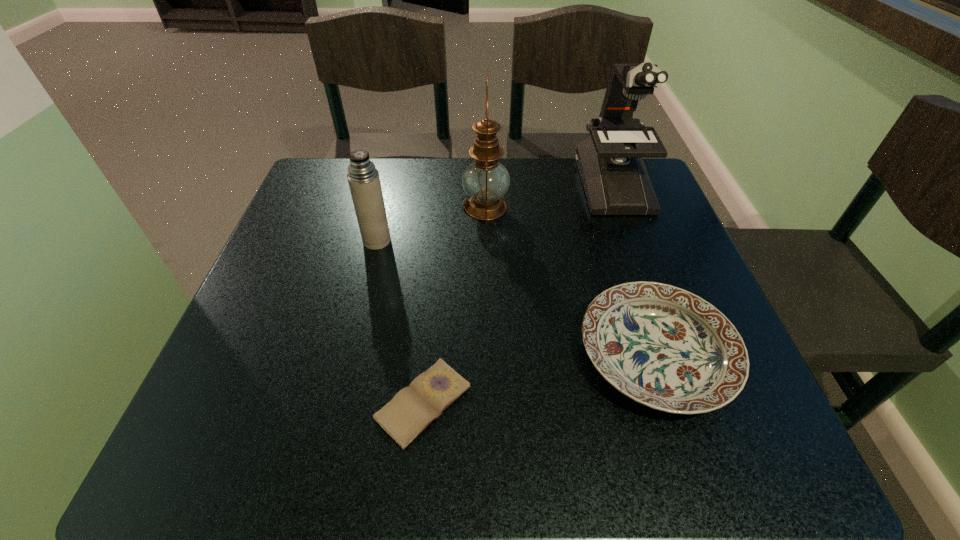
Find the location of a particular element. vacant area at the left edge is located at coordinates (300, 262).

In the image, there is a desktop. At what (x,y) coordinates should I click in order to perform the action: click on vacant space at the right edge. Please return your answer as a coordinate pair (x, y). The width and height of the screenshot is (960, 540). Looking at the image, I should click on (626, 279).

At what (x,y) coordinates should I click in order to perform the action: click on vacant area at the near left corner of the desktop. Please return your answer as a coordinate pair (x, y). Looking at the image, I should click on (239, 423).

In order to click on vacant area that lies between the shortest object and the microscope in this screenshot , I will do `click(518, 294)`.

At what (x,y) coordinates should I click in order to perform the action: click on unoccupied position between the oil lamp and the microscope. Please return your answer as a coordinate pair (x, y). The image size is (960, 540). Looking at the image, I should click on [549, 196].

You are a GUI agent. You are given a task and a screenshot of the screen. Output one action in this format:
    pyautogui.click(x=<x>, y=<y>)
    Task: Click on the free space between the plate and the oil lamp
    
    Given the screenshot: What is the action you would take?
    pyautogui.click(x=570, y=281)

Locate an element on the screen. This screenshot has height=540, width=960. empty location between the microscope and the second shortest object is located at coordinates (634, 270).

Where is `free spot between the plate and the oil lamp`? Image resolution: width=960 pixels, height=540 pixels. free spot between the plate and the oil lamp is located at coordinates point(570,281).

Find the location of a particular element. Image resolution: width=960 pixels, height=540 pixels. vacant point located between the microscope and the plate is located at coordinates (634, 270).

Where is `empty space that is in between the second shortest object and the oil lamp`? Image resolution: width=960 pixels, height=540 pixels. empty space that is in between the second shortest object and the oil lamp is located at coordinates (570, 281).